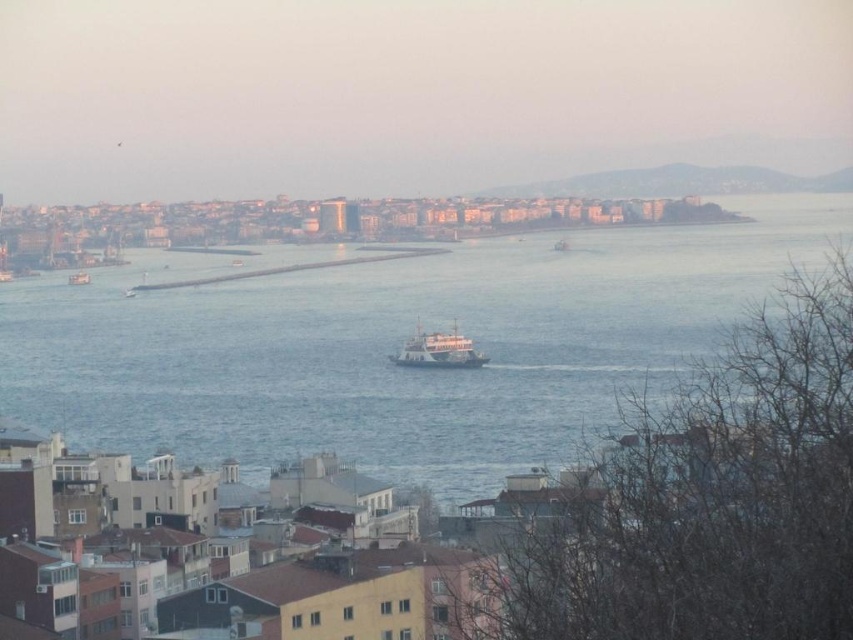
Is blue water at center to the left of white matte boat at left from the viewer's perspective?

Incorrect, blue water at center is not on the left side of white matte boat at left.

Which of these two, blue water at center or white matte boat at left, stands shorter?

Standing shorter between the two is white matte boat at left.

Identify the location of blue water at center. The height and width of the screenshot is (640, 853). (393, 344).

The width and height of the screenshot is (853, 640). I want to click on blue water at center, so click(x=393, y=344).

Between blue water at center and white matte ferry at center, which one appears on the left side from the viewer's perspective?

Positioned to the left is white matte ferry at center.

Which is in front, point (120, 337) or point (450, 346)?

Positioned in front is point (450, 346).

Find the location of `blue water at center`. blue water at center is located at coordinates (393, 344).

Does point (444, 360) come closer to viewer compared to point (86, 282)?

Yes, point (444, 360) is in front of point (86, 282).

Is point (469, 356) less distant than point (86, 276)?

Yes, it is in front of point (86, 276).

Find the location of `white matte ferry at center`. white matte ferry at center is located at coordinates (438, 352).